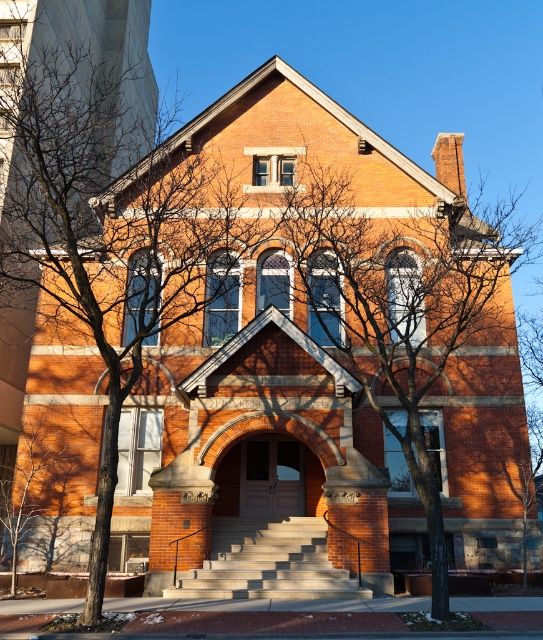
Locate an element on the screen. The height and width of the screenshot is (640, 543). bare branches at center is located at coordinates (400, 317).

Does bare branches at center have a greater height compared to light gray concrete stairs at center?

Correct, bare branches at center is much taller as light gray concrete stairs at center.

Is point (469, 352) farther from viewer compared to point (264, 595)?

Yes, point (469, 352) is farther from viewer.

Locate an element on the screen. bare branches at center is located at coordinates (400, 317).